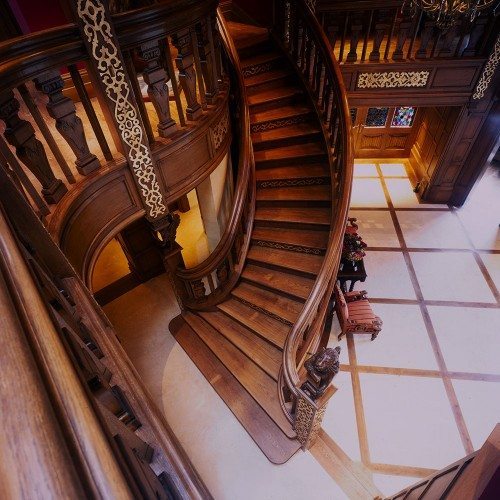
Find the location of a particular element. The height and width of the screenshot is (500, 500). handrails is located at coordinates (350, 150), (233, 198).